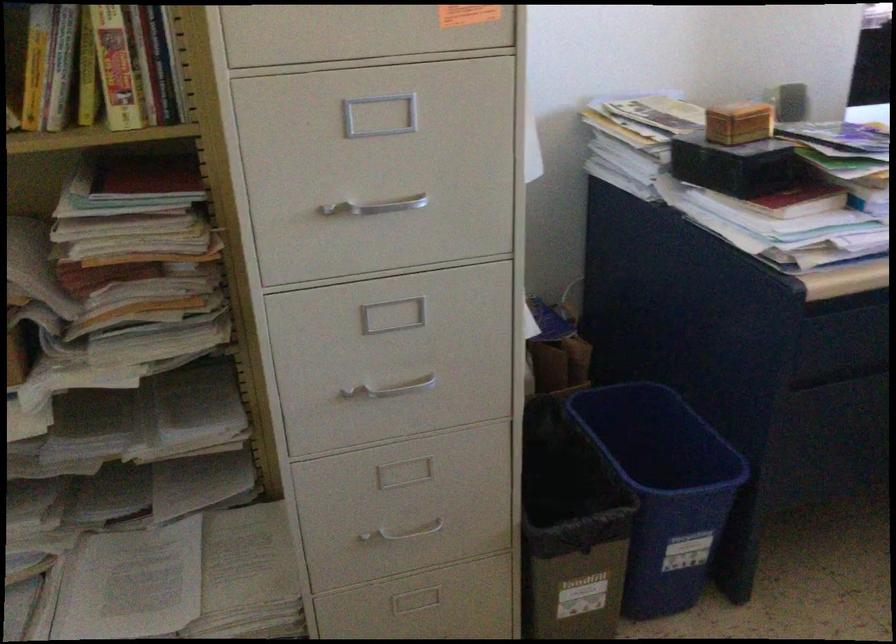
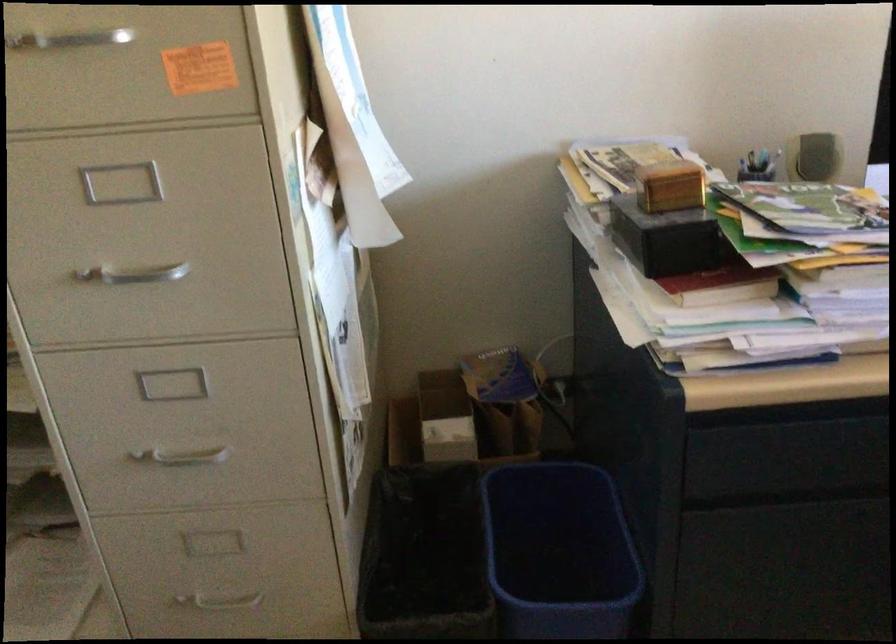
Locate, in the second image, the point that corresponds to (624,462) in the first image.

(558, 552)